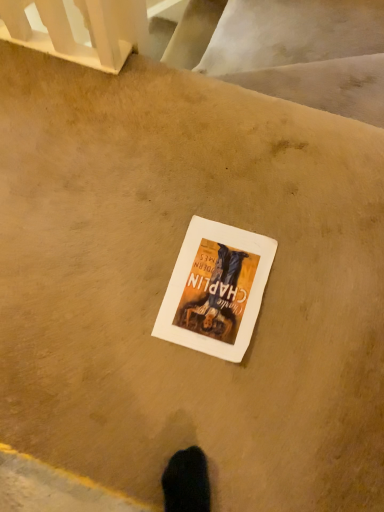
I want to click on free point behind white paper at center, so click(217, 189).